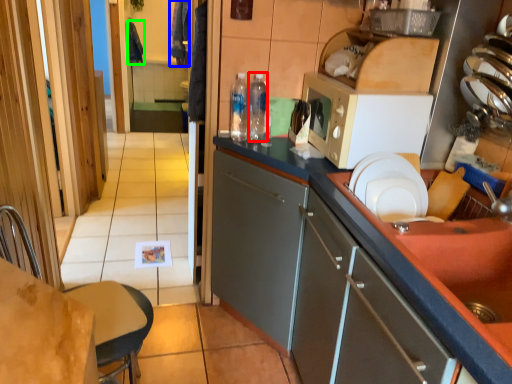
Question: Considering the real-world distances, which object is closest to bottle (highlighted by a red box)? laundry (highlighted by a blue box) or laundry (highlighted by a green box).

Choices:
 (A) laundry
 (B) laundry

Answer: (A)